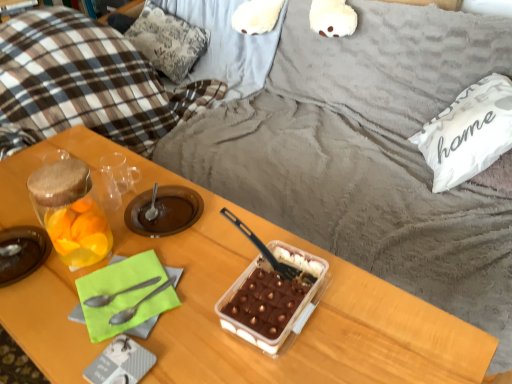
Question: Is black plastic spoon at center, the third spoon from the left, oriented away from translucent plastic tray at center, the first snack when ordered from right to left?

Choices:
 (A) no
 (B) yes

Answer: (A)

Question: Is black plastic spoon at center, the first spoon positioned from the right, oriented towards translucent plastic tray at center, the first snack when ordered from right to left?

Choices:
 (A) no
 (B) yes

Answer: (B)

Question: Is black plastic spoon at center, the first spoon positioned from the right, outside translucent plastic tray at center, the 2th snack positioned from the left?

Choices:
 (A) no
 (B) yes

Answer: (B)

Question: Can you confirm if black plastic spoon at center, the third spoon from the left, is shorter than translucent plastic tray at center, the first snack when ordered from right to left?

Choices:
 (A) no
 (B) yes

Answer: (A)

Question: From a real-world perspective, is black plastic spoon at center, the first spoon positioned from the right, below translucent plastic tray at center, the first snack when ordered from right to left?

Choices:
 (A) yes
 (B) no

Answer: (B)

Question: Would you say wooden table at center is to the left or to the right of translucent glass jar at left in the picture?

Choices:
 (A) left
 (B) right

Answer: (B)

Question: In terms of size, does wooden table at center appear bigger or smaller than translucent glass jar at left?

Choices:
 (A) small
 (B) big

Answer: (B)

Question: In the image, is wooden table at center positioned in front of or behind translucent glass jar at left?

Choices:
 (A) behind
 (B) front

Answer: (B)

Question: Considering the positions of point (31, 302) and point (39, 261), is point (31, 302) closer or farther from the camera than point (39, 261)?

Choices:
 (A) farther
 (B) closer

Answer: (B)

Question: From the image's perspective, is wooden table at center located above or below translucent glass jar at left, the first snack in the left-to-right sequence?

Choices:
 (A) below
 (B) above

Answer: (A)

Question: In terms of height, does wooden table at center look taller or shorter compared to translucent glass jar at left, the 2th snack viewed from the right?

Choices:
 (A) tall
 (B) short

Answer: (A)

Question: Is point (326, 292) positioned closer to the camera than point (53, 218)?

Choices:
 (A) farther
 (B) closer

Answer: (B)

Question: Based on their sizes in the image, would you say wooden table at center is bigger or smaller than translucent glass jar at left, the 2th snack viewed from the right?

Choices:
 (A) small
 (B) big

Answer: (B)

Question: From a real-world perspective, is wooden table at center positioned above or below translucent plastic tray at center, the first snack when ordered from right to left?

Choices:
 (A) above
 (B) below

Answer: (B)

Question: From the image's perspective, is wooden table at center located above or below translucent plastic tray at center, the first snack when ordered from right to left?

Choices:
 (A) below
 (B) above

Answer: (A)